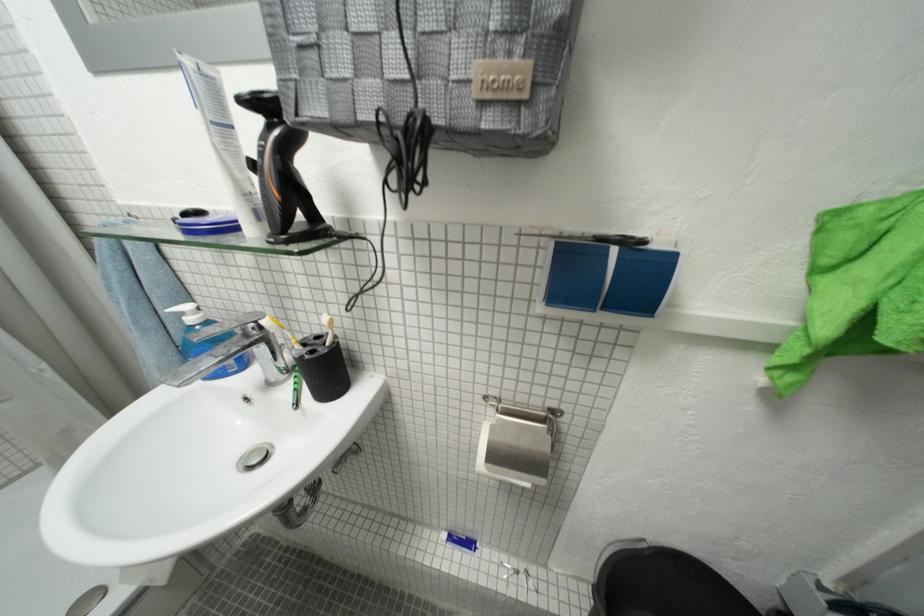
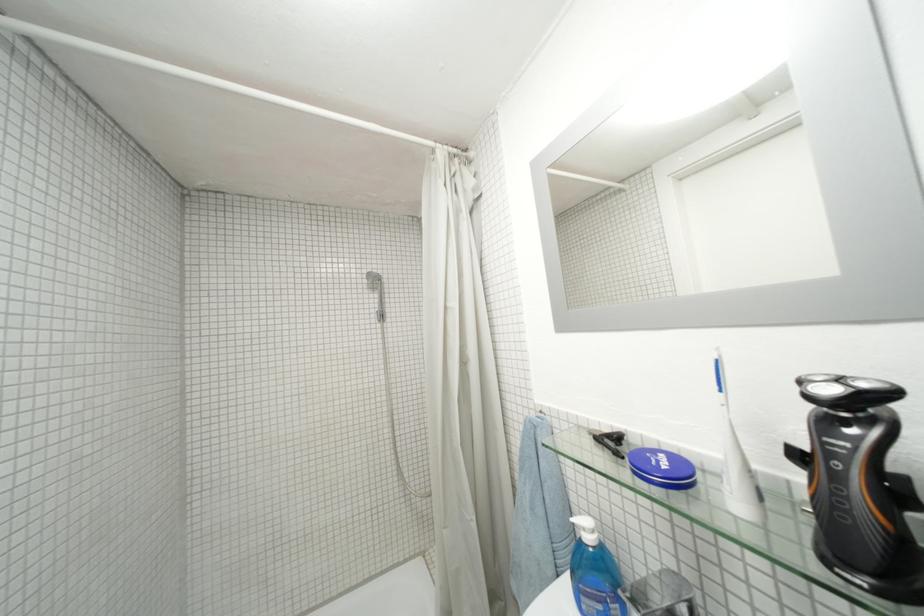
Where in the second image is the point corresponding to pixel 201 322 from the first image?

(598, 541)